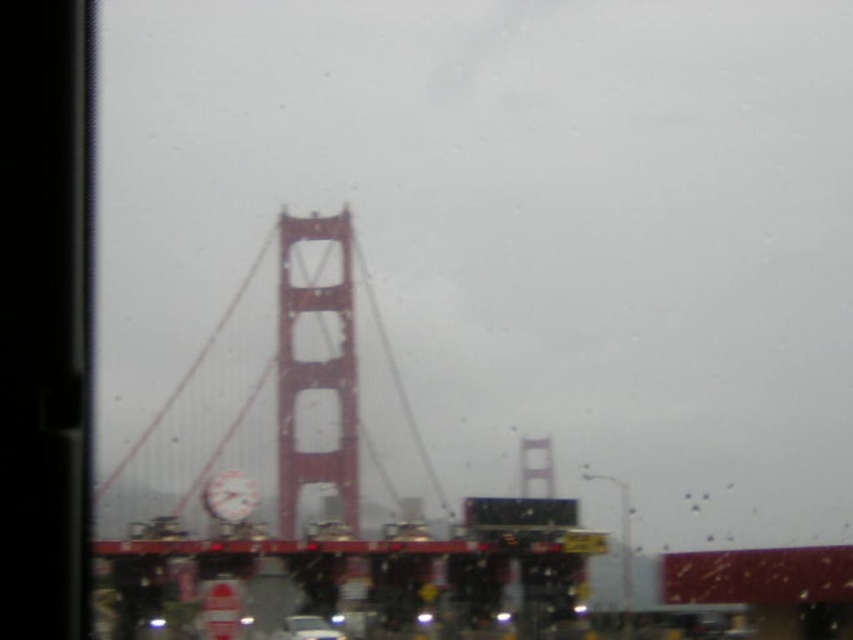
Based on the photo, you are driving a metallic silver car at center and want to take a photo of the metallic red suspension bridge at center. Since both are at the center, which direction should you move your car to get the bridge fully in frame?

The metallic red suspension bridge at center is to the right of the metallic silver car at center, so you should move your car to the left to get the bridge fully in frame.

Based on the photo, what object is located at the coordinates point (x=317, y=484) in the image?

The point (x=317, y=484) indicates the metallic red suspension bridge at center.